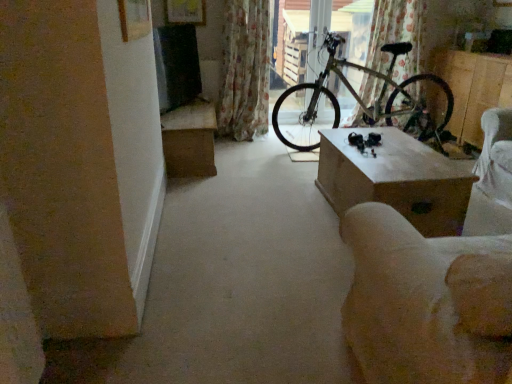
This screenshot has height=384, width=512. I want to click on vacant space to the left of wooden table at center, the 2th table viewed from the back, so coord(269,209).